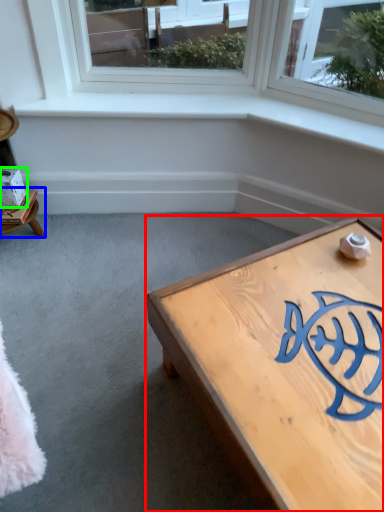
Question: Estimate the real-world distances between objects in this image. Which object is farther from coffee table (highlighted by a red box), furniture (highlighted by a blue box) or box (highlighted by a green box)?

Choices:
 (A) furniture
 (B) box

Answer: (B)